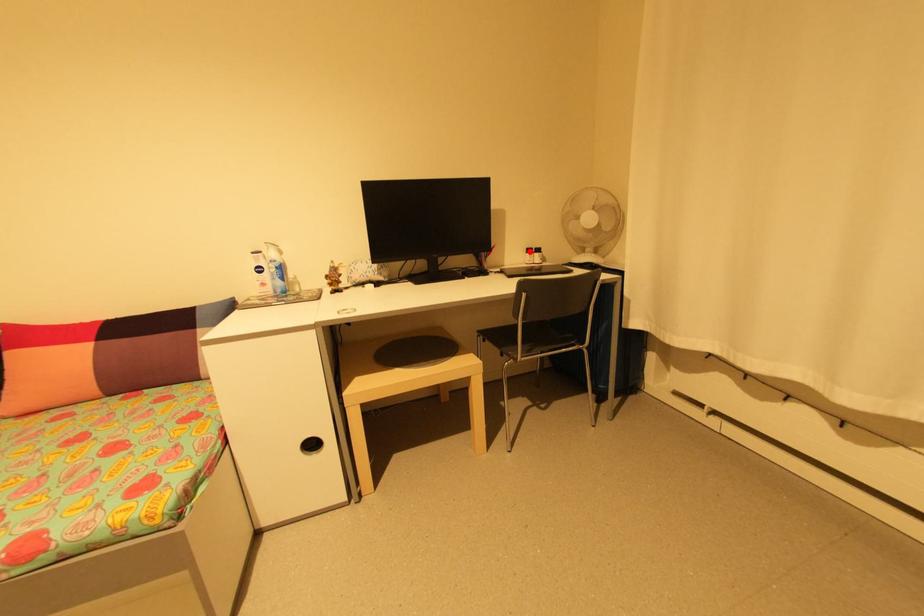
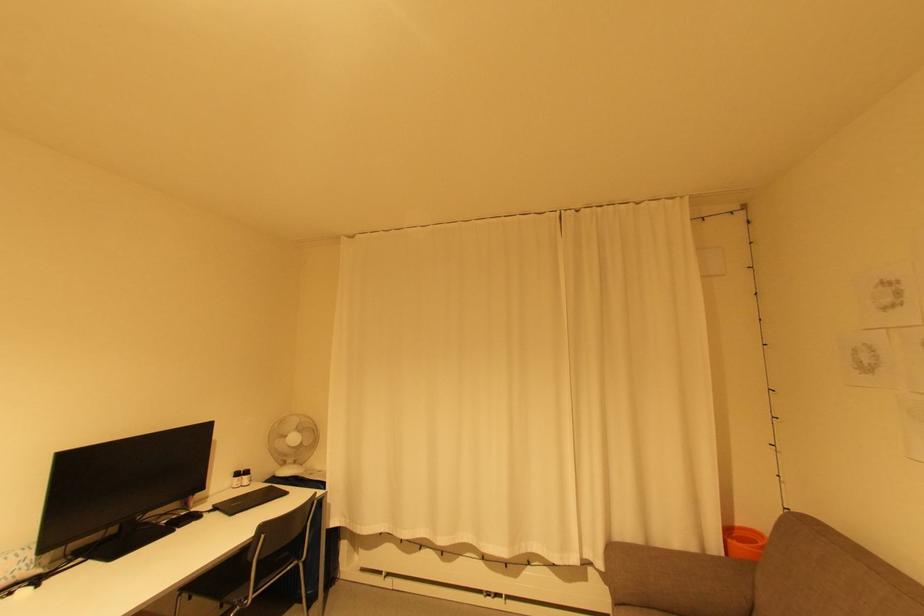
Locate, in the second image, the point that corresponds to the highlighted location in the first image.

(237, 476)